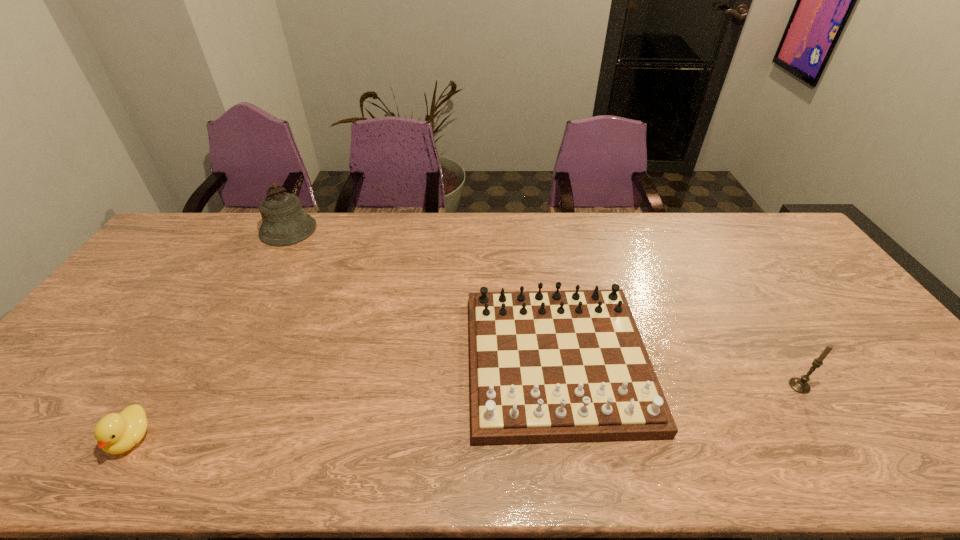
At what (x,y) coordinates should I click in order to perform the action: click on free space between the duckling and the chessboard. Please return your answer as a coordinate pair (x, y). This screenshot has height=540, width=960. Looking at the image, I should click on (345, 400).

Locate an element on the screen. free point between the candle and the chessboard is located at coordinates (678, 373).

This screenshot has height=540, width=960. Find the location of `vacant area between the candle and the duckling`. vacant area between the candle and the duckling is located at coordinates (466, 412).

At what (x,y) coordinates should I click in order to perform the action: click on free space between the duckling and the chessboard. Please return your answer as a coordinate pair (x, y). This screenshot has height=540, width=960. Looking at the image, I should click on (345, 400).

I want to click on object that is the closest to the candle, so click(x=557, y=366).

Where is `object that stands as the third closest to the chessboard`? object that stands as the third closest to the chessboard is located at coordinates (115, 433).

Locate an element on the screen. Image resolution: width=960 pixels, height=540 pixels. free spot that satisfies the following two spatial constraints: 1. on the front side of the tallest object; 2. on the right side of the chessboard is located at coordinates (217, 361).